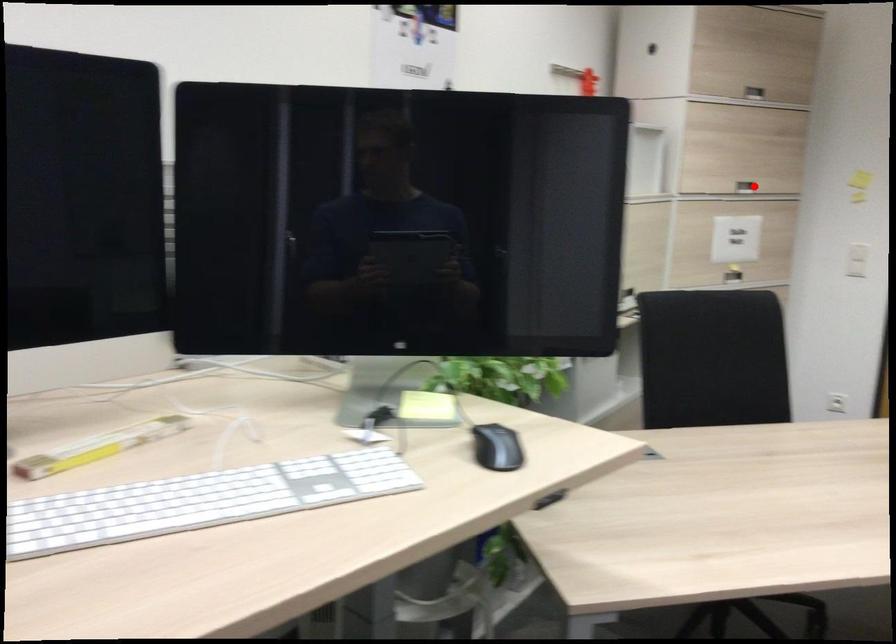
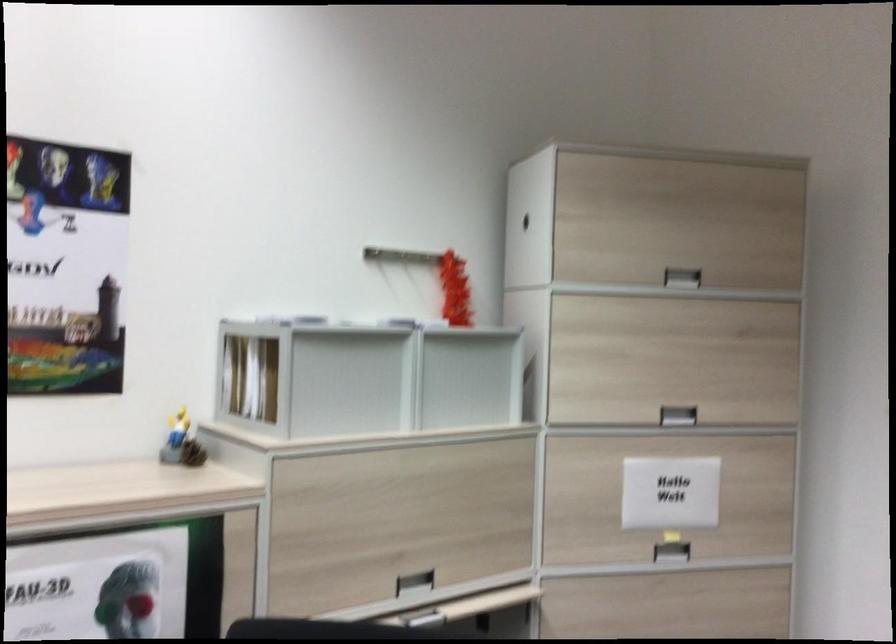
The point at the highlighted location is marked in the first image. Where is the corresponding point in the second image?

(677, 415)